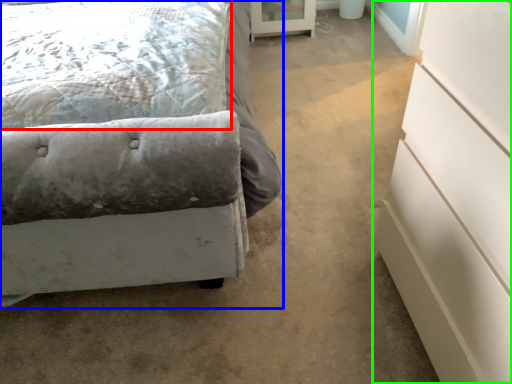
Question: Considering the real-world distances, which object is closest to pillow (highlighted by a red box)? bed (highlighted by a blue box) or chest of drawers (highlighted by a green box).

Choices:
 (A) bed
 (B) chest of drawers

Answer: (A)